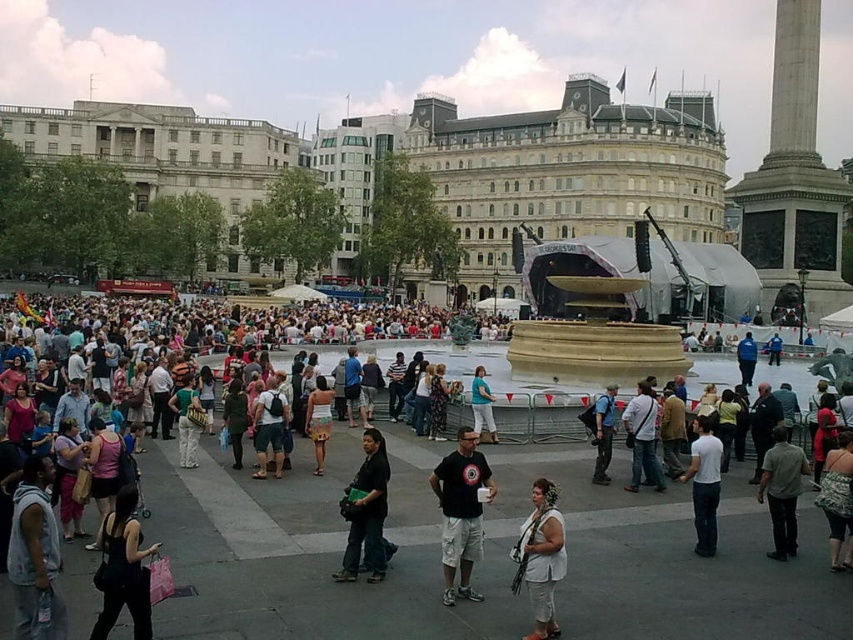
You are a photographer standing in the public square and want to take a photo of the monument in the background. You notice the dark blue backpack at center and the dark green fabric dress at center are blocking your view. Which object should you move to get a clear shot of the monument?

You should move the dark blue backpack at center because it is in front of the dark green fabric dress at center, meaning it is closer to you and blocking the view more directly.